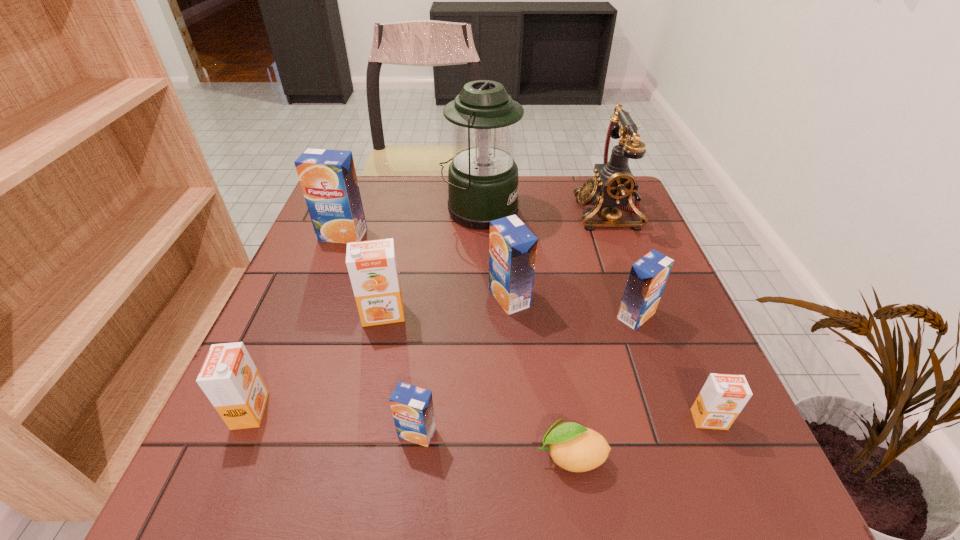
You are a GUI agent. You are given a task and a screenshot of the screen. Output one action in this format:
    pyautogui.click(x=<x>, y=<y>)
    Task: Click on the rightmost blue orange_juice
    Image resolution: width=960 pixels, height=540 pixels.
    Given the screenshot: What is the action you would take?
    pyautogui.click(x=648, y=276)

At what (x,y) coordinates should I click in order to perform the action: click on the second biggest orange orange juice. Please return your answer as a coordinate pair (x, y). The image size is (960, 540). Looking at the image, I should click on (229, 378).

At what (x,y) coordinates should I click in order to perform the action: click on the smallest blue orange_juice. Please return your answer as a coordinate pair (x, y). Looking at the image, I should click on (412, 407).

Find the location of `the third blue orange_juice from right to left`. the third blue orange_juice from right to left is located at coordinates (412, 407).

Locate an element on the screen. Image resolution: width=960 pixels, height=540 pixels. the smallest orange orange juice is located at coordinates (723, 396).

Find the location of a particular element. the shortest object is located at coordinates click(573, 447).

Identify the location of yellow lemon. (573, 447).

You are a GUI agent. You are given a task and a screenshot of the screen. Output one action in this format:
    pyautogui.click(x=<x>, y=<y>)
    Task: Click on the vacant space situated on the front of the tallest object
    Image resolution: width=960 pixels, height=540 pixels.
    Given the screenshot: What is the action you would take?
    pyautogui.click(x=479, y=256)

The image size is (960, 540). Identify the location of free space located 0.330m on the front of the telephone, featuring the rotary dial. (453, 212).

Find the location of a particular element. vacant space located 0.100m on the front of the telephone, featuring the rotary dial is located at coordinates (539, 212).